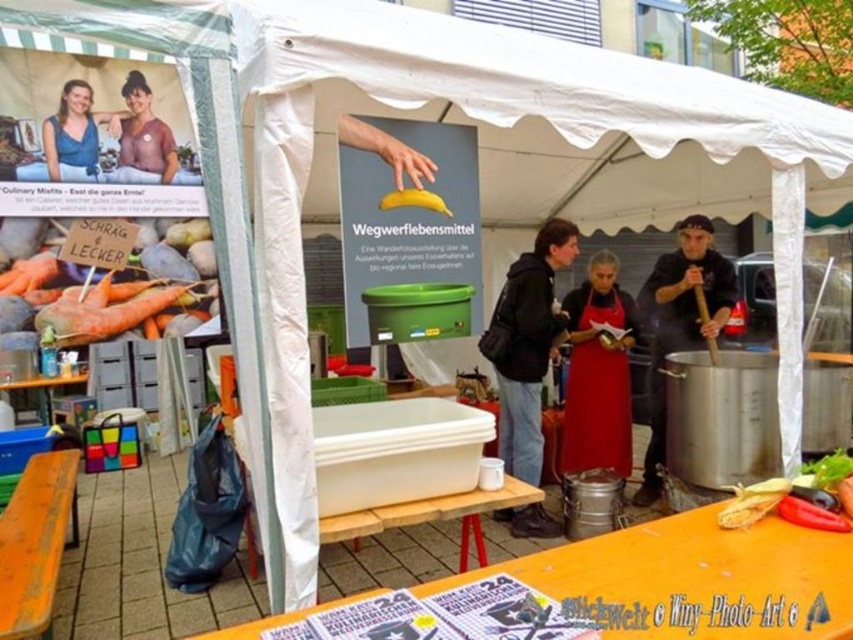
You are a vendor at the market and need to place a new sign that is 1.2 meters tall. The existing matte white poster at center is already in place. Can the new sign be placed next to the red matte pepper at lower right without exceeding the height of the poster?

The matte white poster at center is taller than the red matte pepper at lower right. Since the new sign is 1.2 meters tall, we need to compare its height with the poster. However, the exact height of the poster isn not provided. Therefore, it is uncertain whether the new sign will exceed the poster height. Further information is needed to determine this.

What is the 2D coordinate of the matte white poster at center?

The matte white poster at center is located at the 2D coordinate point of (409, 220).